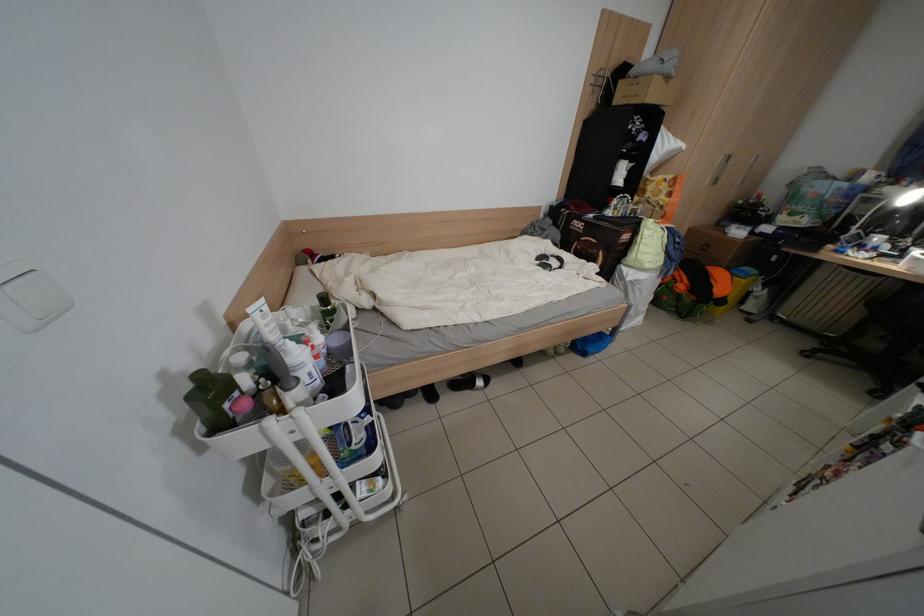
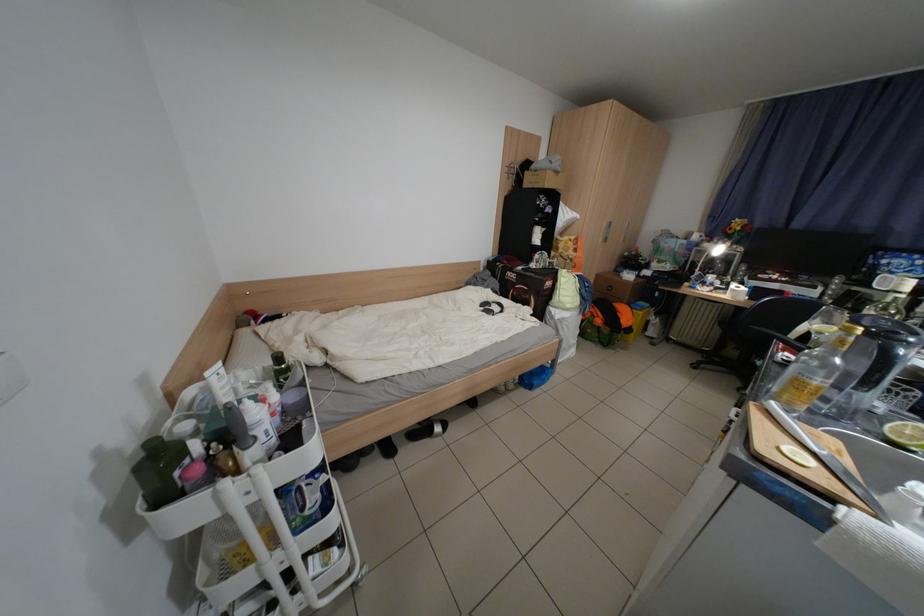
Question: The camera is either moving clockwise (left) or counter-clockwise (right) around the object. The first image is from the beginning of the video and the second image is from the end. Is the camera moving left or right when shooting the video?

Choices:
 (A) Left
 (B) Right

Answer: (A)